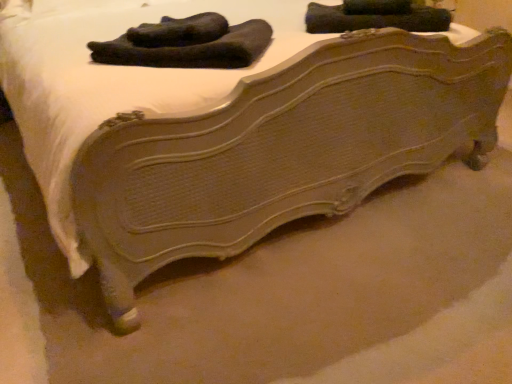
Find the location of a particular element. velvet-like black socks at upper center is located at coordinates (374, 20).

What do you see at coordinates (374, 20) in the screenshot?
I see `velvet-like black socks at upper center` at bounding box center [374, 20].

What is the approximate height of velvet-like black socks at upper center?

It is 3.69 inches.

You are a GUI agent. You are given a task and a screenshot of the screen. Output one action in this format:
    pyautogui.click(x=<x>, y=<y>)
    Task: Click on the black fuzzy socks at upper center
    
    Given the screenshot: What is the action you would take?
    pyautogui.click(x=187, y=43)

What do you see at coordinates (187, 43) in the screenshot? I see `black fuzzy socks at upper center` at bounding box center [187, 43].

Identify the location of velvet-like black socks at upper center. (374, 20).

Between velvet-like black socks at upper center and black fuzzy socks at upper center, which one appears on the left side from the viewer's perspective?

Positioned to the left is black fuzzy socks at upper center.

Is velvet-like black socks at upper center positioned in front of black fuzzy socks at upper center?

No, velvet-like black socks at upper center is behind black fuzzy socks at upper center.

Is point (426, 15) farther from camera compared to point (249, 34)?

Yes, point (426, 15) is behind point (249, 34).

From the image's perspective, is velvet-like black socks at upper center located above or below black fuzzy socks at upper center?

velvet-like black socks at upper center is above black fuzzy socks at upper center.

From a real-world perspective, does velvet-like black socks at upper center stand above black fuzzy socks at upper center?

Indeed, from a real-world perspective, velvet-like black socks at upper center stands above black fuzzy socks at upper center.

Is velvet-like black socks at upper center thinner than black fuzzy socks at upper center?

Yes.

From their relative heights in the image, would you say velvet-like black socks at upper center is taller or shorter than black fuzzy socks at upper center?

In the image, velvet-like black socks at upper center appears to be taller than black fuzzy socks at upper center.

Consider the image. Considering the relative sizes of velvet-like black socks at upper center and black fuzzy socks at upper center in the image provided, is velvet-like black socks at upper center bigger than black fuzzy socks at upper center?

Correct, velvet-like black socks at upper center is larger in size than black fuzzy socks at upper center.

Is black fuzzy socks at upper center completely or partially inside velvet-like black socks at upper center?

That's incorrect, black fuzzy socks at upper center is not inside velvet-like black socks at upper center.

Are velvet-like black socks at upper center and black fuzzy socks at upper center located far from each other?

That's not correct — velvet-like black socks at upper center is a little close to black fuzzy socks at upper center.

Looking at this image, does velvet-like black socks at upper center turn towards black fuzzy socks at upper center?

No, velvet-like black socks at upper center is not aimed at black fuzzy socks at upper center.

From the picture: How many degrees apart are the facing directions of velvet-like black socks at upper center and black fuzzy socks at upper center?

There is a 6.21-degree angle between the facing directions of velvet-like black socks at upper center and black fuzzy socks at upper center.

Locate an element on the screen. The width and height of the screenshot is (512, 384). clothing lying above the black fuzzy socks at upper center (from the image's perspective) is located at coordinates (374, 20).

Looking at this image, which object is positioned more to the left, black fuzzy socks at upper center or velvet-like black socks at upper center?

black fuzzy socks at upper center.

Considering their positions, is black fuzzy socks at upper center located in front of or behind velvet-like black socks at upper center?

black fuzzy socks at upper center is positioned closer to the viewer than velvet-like black socks at upper center.

Does point (247, 49) come in front of point (404, 23)?

Yes, it is in front of point (404, 23).

From the image's perspective, does black fuzzy socks at upper center appear lower than velvet-like black socks at upper center?

Yes, from the image's perspective, black fuzzy socks at upper center is below velvet-like black socks at upper center.

From a real-world perspective, relative to velvet-like black socks at upper center, is black fuzzy socks at upper center vertically above or below?

In terms of real-world spatial position, black fuzzy socks at upper center is below velvet-like black socks at upper center.

Which object is thinner, black fuzzy socks at upper center or velvet-like black socks at upper center?

velvet-like black socks at upper center.

Between black fuzzy socks at upper center and velvet-like black socks at upper center, which one has less height?

black fuzzy socks at upper center.

Which of these two, black fuzzy socks at upper center or velvet-like black socks at upper center, is bigger?

Bigger between the two is velvet-like black socks at upper center.

Is black fuzzy socks at upper center positioned beyond the bounds of velvet-like black socks at upper center?

black fuzzy socks at upper center lies outside velvet-like black socks at upper center's area.

Is black fuzzy socks at upper center in contact with velvet-like black socks at upper center?

No, black fuzzy socks at upper center is not beside velvet-like black socks at upper center.

Could you tell me if black fuzzy socks at upper center is turned towards velvet-like black socks at upper center?

No, black fuzzy socks at upper center does not turn towards velvet-like black socks at upper center.

How many degrees apart are the facing directions of black fuzzy socks at upper center and velvet-like black socks at upper center?

There is a 6.21-degree angle between the facing directions of black fuzzy socks at upper center and velvet-like black socks at upper center.

Based on the photo, how much distance is there between black fuzzy socks at upper center and velvet-like black socks at upper center?

The distance of black fuzzy socks at upper center from velvet-like black socks at upper center is 22.23 inches.

Locate an element on the screen. This screenshot has width=512, height=384. clothing above the black fuzzy socks at upper center (from the image's perspective) is located at coordinates (374, 20).

Image resolution: width=512 pixels, height=384 pixels. In order to click on laundry below the velvet-like black socks at upper center (from a real-world perspective) in this screenshot , I will do `click(187, 43)`.

What are the coordinates of `clothing above the black fuzzy socks at upper center (from a real-world perspective)` in the screenshot? It's located at (374, 20).